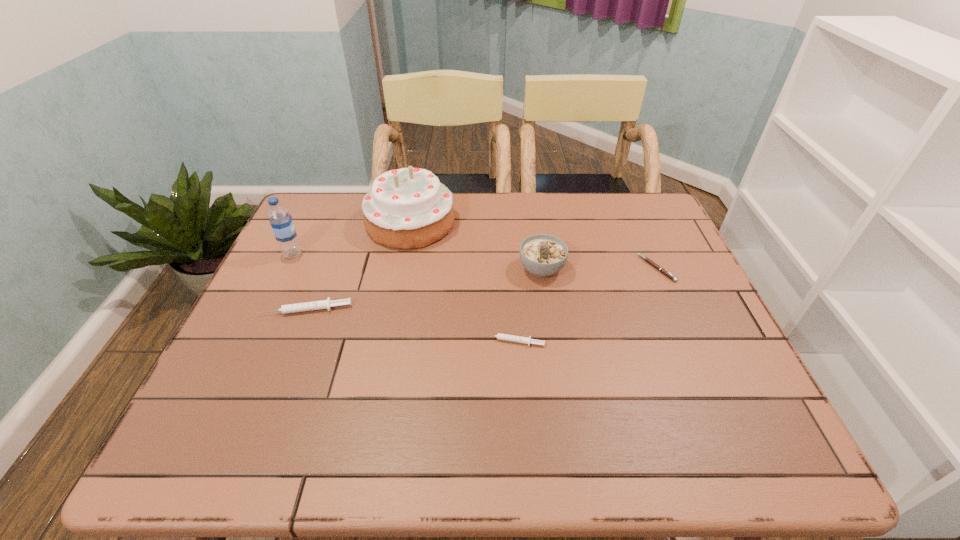
Find the location of a particular element. The image size is (960, 540). unoccupied area between the third tallest object and the shortest object is located at coordinates (599, 268).

The width and height of the screenshot is (960, 540). In order to click on vacant region between the third tallest object and the water bottle in this screenshot , I will do `click(418, 261)`.

Image resolution: width=960 pixels, height=540 pixels. Identify the location of vacant area that lies between the cake and the left syringe. (358, 266).

Locate an element on the screen. Image resolution: width=960 pixels, height=540 pixels. free point between the soup bowl and the left syringe is located at coordinates (424, 289).

Where is `free point between the pen and the nearest object`? Image resolution: width=960 pixels, height=540 pixels. free point between the pen and the nearest object is located at coordinates (585, 305).

Find the location of a particular element. The width and height of the screenshot is (960, 540). free area in between the water bottle and the cake is located at coordinates (351, 238).

At what (x,y) coordinates should I click in order to perform the action: click on free space between the cake and the right syringe. Please return your answer as a coordinate pair (x, y). This screenshot has height=540, width=960. Looking at the image, I should click on (462, 282).

Locate an element on the screen. This screenshot has width=960, height=540. object identified as the second closest to the second nearest object is located at coordinates (408, 208).

Locate an element on the screen. object that stands as the closest to the nearer syringe is located at coordinates (543, 255).

Where is `vacant region that satisfies the following two spatial constraints: 1. at the nib of the pen; 2. on the front side of the soup bowl`? The image size is (960, 540). vacant region that satisfies the following two spatial constraints: 1. at the nib of the pen; 2. on the front side of the soup bowl is located at coordinates (657, 269).